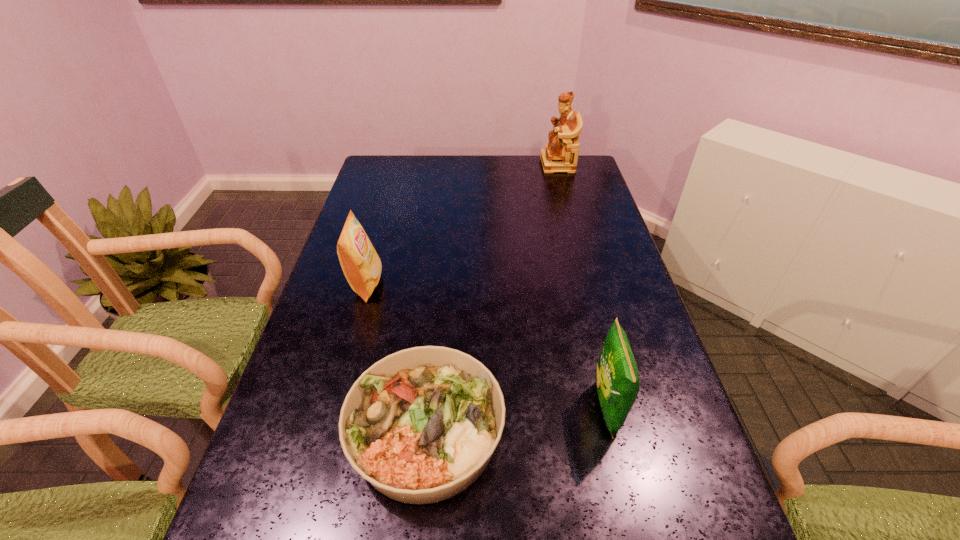
At what (x,y) coordinates should I click in order to perform the action: click on blank area located 0.400m on the front-facing side of the nearer crisp (potato chip). Please return your answer as a coordinate pair (x, y). Image resolution: width=960 pixels, height=540 pixels. Looking at the image, I should click on (408, 408).

Locate an element on the screen. This screenshot has height=540, width=960. vacant space located on the front-facing side of the nearer crisp (potato chip) is located at coordinates (421, 408).

Find the location of a particular element. The height and width of the screenshot is (540, 960). free location located on the front-facing side of the nearer crisp (potato chip) is located at coordinates (449, 408).

The width and height of the screenshot is (960, 540). What are the coordinates of `vacant position located on the front-facing side of the left crisp (potato chip)` in the screenshot? It's located at (478, 284).

This screenshot has width=960, height=540. I want to click on vacant space located on the left of the second object from left to right, so click(x=296, y=432).

Where is `object at the far edge`? This screenshot has height=540, width=960. object at the far edge is located at coordinates (561, 153).

At what (x,y) coordinates should I click in order to perform the action: click on object present at the left edge. Please return your answer as a coordinate pair (x, y). The height and width of the screenshot is (540, 960). Looking at the image, I should click on (361, 265).

Locate an element on the screen. The image size is (960, 540). figurine that is at the right edge is located at coordinates (561, 153).

You are a GUI agent. You are given a task and a screenshot of the screen. Output one action in this format:
    pyautogui.click(x=<x>, y=<y>)
    Task: Click on the crisp (potato chip) at the right edge
    
    Given the screenshot: What is the action you would take?
    pyautogui.click(x=617, y=379)

At what (x,y) coordinates should I click in order to perform the action: click on object that is at the far right corner. Please return your answer as a coordinate pair (x, y). The image size is (960, 540). Looking at the image, I should click on (561, 153).